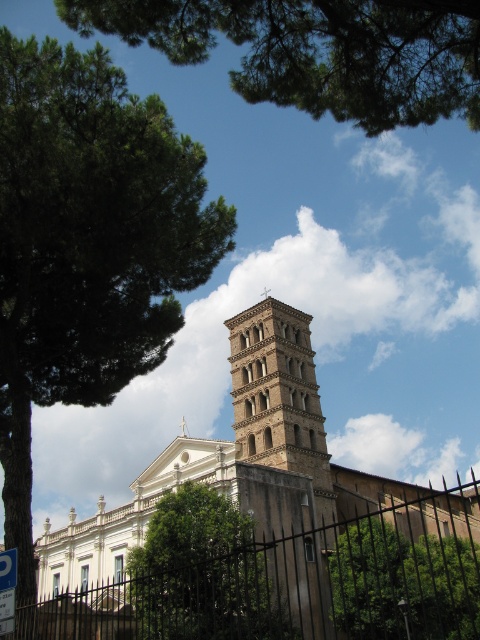
You are standing in front of the historic church and want to determine the spatial relationship between two points marked on a map. The points are labeled as point 1 at coordinates point (123, 593) and point 2 at coordinates point (406, 538). Based on the image provided, which point is closer to you, point 1 or point 2?

Point 1 at coordinates point (123, 593) is closer to you because it is in front of point 2 at coordinates point (406, 538) according to the spatial description provided.

You are a visitor standing in front of the historic church. You see the black metal fence at lower center and the green leafy tree at upper left. Which object is closer to you?

The black metal fence at lower center is closer to you since the green leafy tree at upper left is behind it.